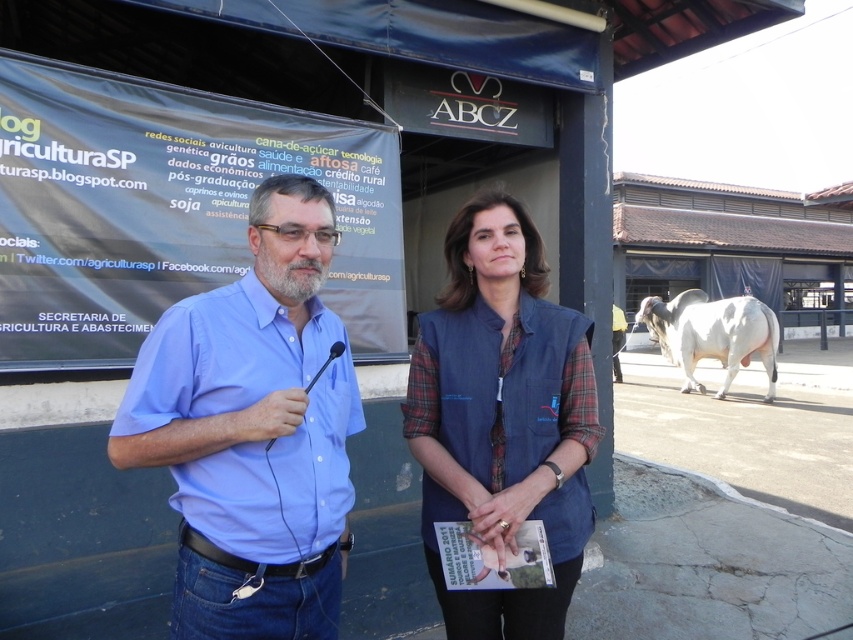
Question: Among these points, which one is nearest to the camera?

Choices:
 (A) (341, 468)
 (B) (518, 368)
 (C) (759, 348)

Answer: (A)

Question: Can you confirm if denim vest at center is positioned above white smooth bull at right?

Choices:
 (A) no
 (B) yes

Answer: (B)

Question: Is denim vest at center smaller than white smooth bull at right?

Choices:
 (A) yes
 (B) no

Answer: (B)

Question: Is the position of blue shirt at left less distant than that of denim vest at center?

Choices:
 (A) no
 (B) yes

Answer: (B)

Question: Which object appears farthest from the camera in this image?

Choices:
 (A) blue shirt at left
 (B) denim vest at center

Answer: (B)

Question: Which object is positioned closest to the white smooth bull at right?

Choices:
 (A) blue shirt at left
 (B) denim vest at center

Answer: (B)